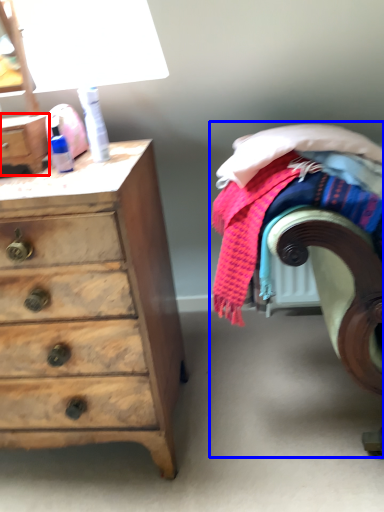
Question: Which point is closer to the camera, chest (highlighted by a red box) or bed (highlighted by a blue box)?

Choices:
 (A) chest
 (B) bed

Answer: (B)